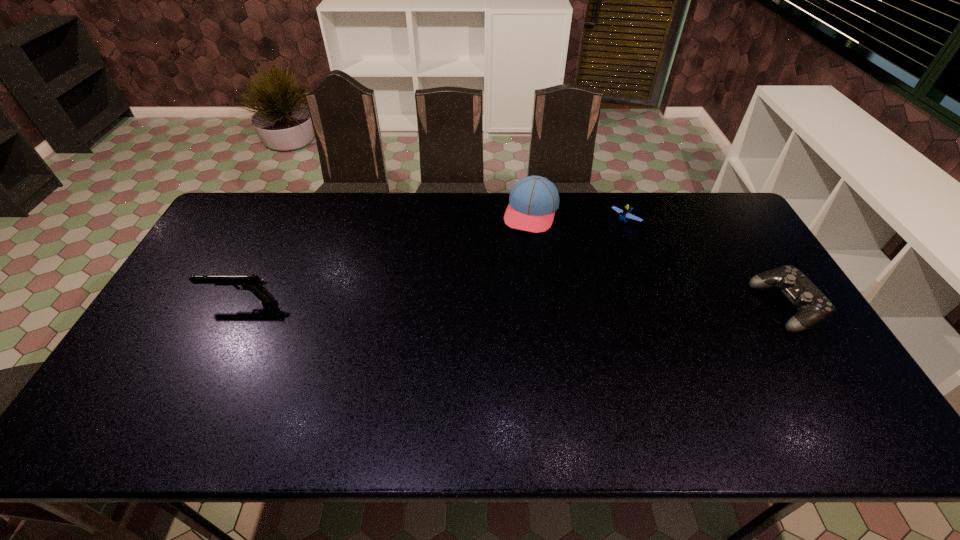
Where is `free space between the third object from right to left and the gun`? Image resolution: width=960 pixels, height=540 pixels. free space between the third object from right to left and the gun is located at coordinates (386, 256).

At what (x,y) coordinates should I click in order to perform the action: click on free space between the Lego and the leftmost object. Please return your answer as a coordinate pair (x, y). Looking at the image, I should click on (433, 261).

You are a GUI agent. You are given a task and a screenshot of the screen. Output one action in this format:
    pyautogui.click(x=<x>, y=<y>)
    Task: Click on the free area in between the leftmost object and the shortest object
    Image resolution: width=960 pixels, height=540 pixels.
    Given the screenshot: What is the action you would take?
    pyautogui.click(x=433, y=261)

Locate an element on the screen. The height and width of the screenshot is (540, 960). object that stands as the third closest to the Lego is located at coordinates (253, 283).

Select which object appears as the third closest to the baseball cap. Please provide its 2D coordinates. Your answer should be formatted as a tuple, i.e. [(x, y)], where the tuple contains the x and y coordinates of a point satisfying the conditions above.

[(253, 283)]

Where is `free space in the image that satisfies the following two spatial constraints: 1. on the front side of the third object from right to left; 2. on the right side of the second shortest object`? This screenshot has width=960, height=540. free space in the image that satisfies the following two spatial constraints: 1. on the front side of the third object from right to left; 2. on the right side of the second shortest object is located at coordinates (543, 307).

The height and width of the screenshot is (540, 960). I want to click on blank area in the image that satisfies the following two spatial constraints: 1. on the front side of the second object from left to right; 2. on the right side of the shortest object, so click(533, 221).

What are the coordinates of `free location that satisfies the following two spatial constraints: 1. on the front side of the third object from right to left; 2. on the left side of the second shortest object` in the screenshot? It's located at (543, 307).